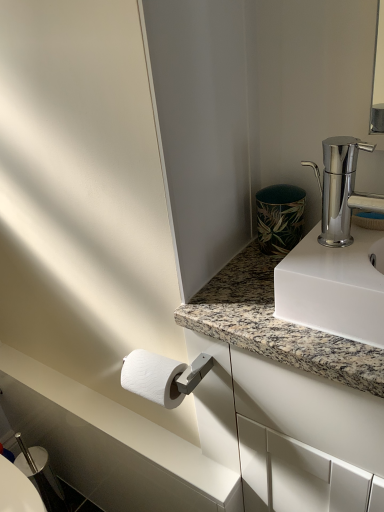
This screenshot has width=384, height=512. I want to click on vacant region to the left of green leaf-patterned ceramic at upper right, so click(231, 266).